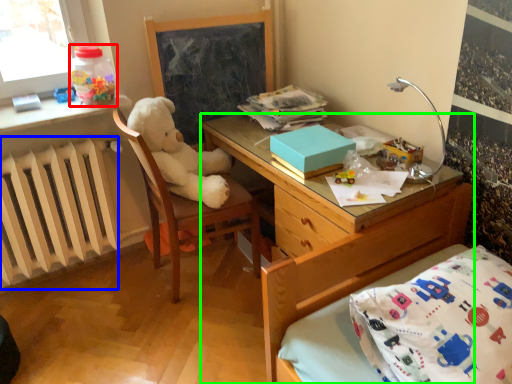
Question: Which object is the closest to the bottle (highlighted by a red box)? Choose among these: radiator (highlighted by a blue box) or desk (highlighted by a green box).

Choices:
 (A) radiator
 (B) desk

Answer: (A)